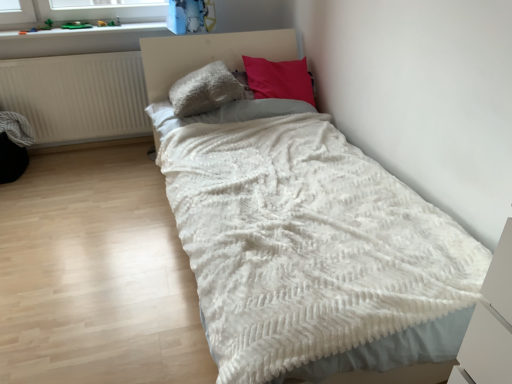
Where is `free space above white matte radiator at left (from a real-world perspective)`? This screenshot has height=384, width=512. free space above white matte radiator at left (from a real-world perspective) is located at coordinates (66, 57).